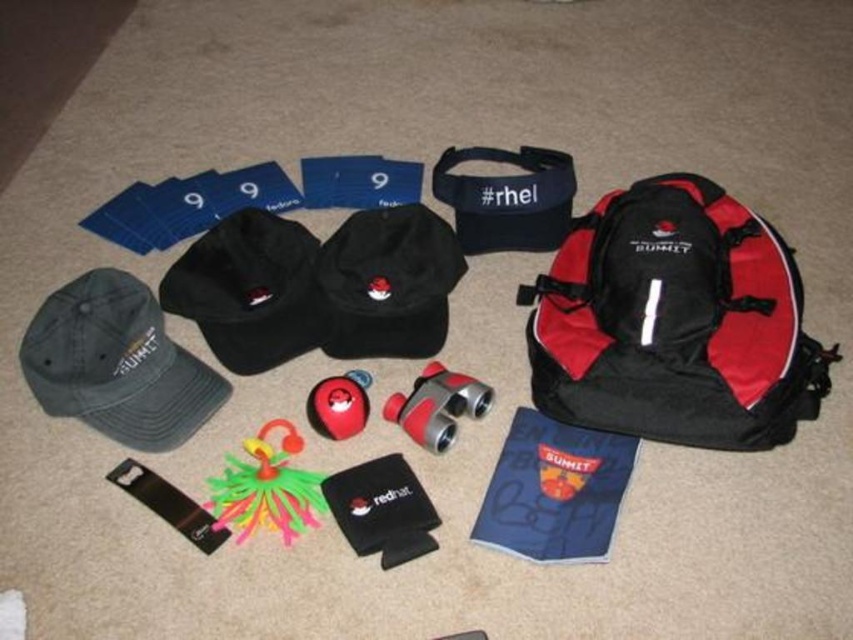
You are organizing a charity event and need to place a donation box at the point marked by point [117,364]. Which item is located at that point?

The point marked by point [117,364] corresponds to the dark gray fabric baseball cap at lower left.

From the picture: You are standing 2 meters away from the floor where the items are placed. Can you see the point at coordinates point (463, 256) from your current position?

The distance of point (463, 256) from viewer is 1.90 meters, so yes, you can see the point at coordinates point (463, 256) from your current position since it is within the 2 meters distance.